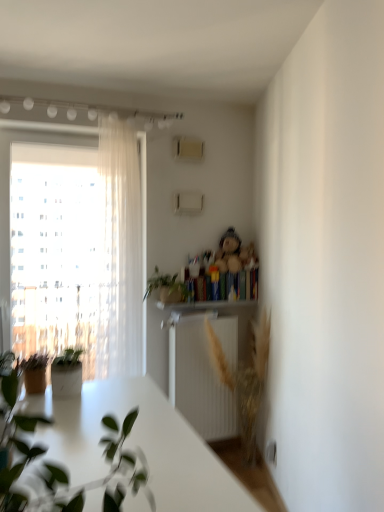
Question: From a real-world perspective, is hardcover book at center located higher than fluffy beige teddy bear at upper center?

Choices:
 (A) no
 (B) yes

Answer: (A)

Question: Can you confirm if hardcover book at center is shorter than fluffy beige teddy bear at upper center?

Choices:
 (A) no
 (B) yes

Answer: (B)

Question: Is the position of hardcover book at center more distant than that of fluffy beige teddy bear at upper center?

Choices:
 (A) yes
 (B) no

Answer: (A)

Question: From the image's perspective, is hardcover book at center beneath fluffy beige teddy bear at upper center?

Choices:
 (A) no
 (B) yes

Answer: (B)

Question: Considering the relative sizes of hardcover book at center and fluffy beige teddy bear at upper center in the image provided, is hardcover book at center thinner than fluffy beige teddy bear at upper center?

Choices:
 (A) yes
 (B) no

Answer: (A)

Question: Can you confirm if hardcover book at center is bigger than fluffy beige teddy bear at upper center?

Choices:
 (A) no
 (B) yes

Answer: (A)

Question: Is wooden shelf at upper center further to camera compared to green matte plant at center, the 2th houseplant positioned from the front?

Choices:
 (A) yes
 (B) no

Answer: (A)

Question: Can you confirm if wooden shelf at upper center is shorter than green matte plant at center, the 2th houseplant positioned from the front?

Choices:
 (A) no
 (B) yes

Answer: (B)

Question: From a real-world perspective, is wooden shelf at upper center positioned over green matte plant at center, which is counted as the first houseplant, starting from the back, based on gravity?

Choices:
 (A) yes
 (B) no

Answer: (B)

Question: Is wooden shelf at upper center to the left of green matte plant at center, the 2th houseplant positioned from the front, from the viewer's perspective?

Choices:
 (A) yes
 (B) no

Answer: (B)

Question: Can you confirm if wooden shelf at upper center is thinner than green matte plant at center, the 2th houseplant positioned from the front?

Choices:
 (A) yes
 (B) no

Answer: (A)

Question: Is wooden shelf at upper center looking in the opposite direction of green matte plant at center, the 2th houseplant positioned from the front?

Choices:
 (A) yes
 (B) no

Answer: (B)

Question: Is sheer white curtain at left oriented away from green matte plant at center, which is counted as the first houseplant, starting from the back?

Choices:
 (A) no
 (B) yes

Answer: (A)